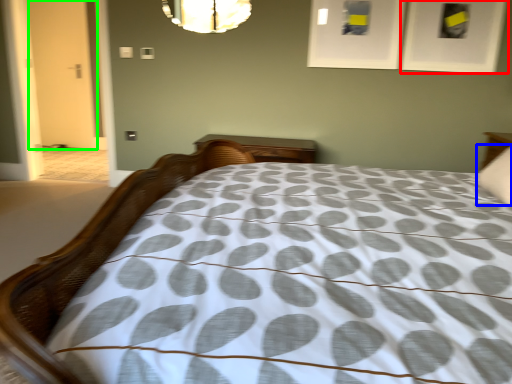
Question: Which object is the closest to the picture frame (highlighted by a red box)? Choose among these: pillow (highlighted by a blue box) or door (highlighted by a green box).

Choices:
 (A) pillow
 (B) door

Answer: (A)